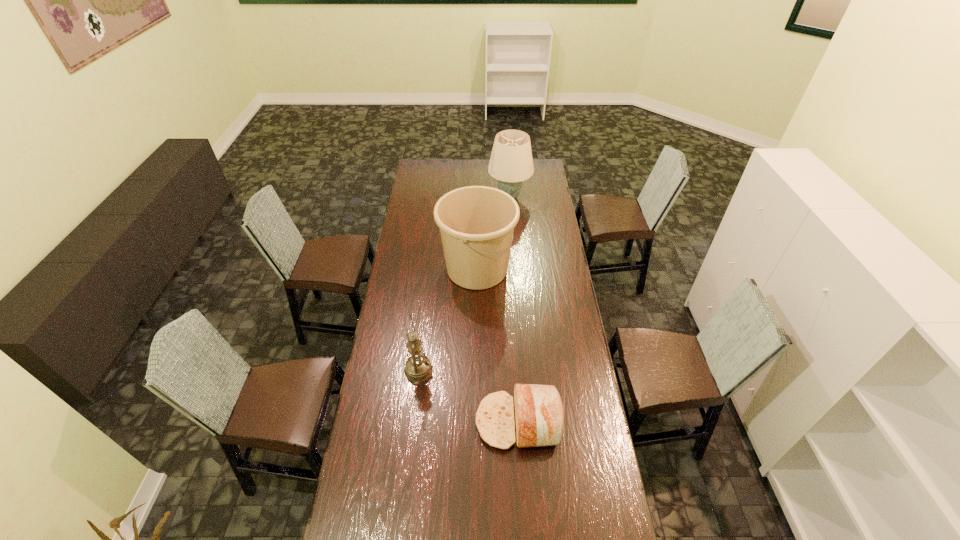
Where is `lampshade`? lampshade is located at coordinates (511, 162).

Identify the location of bucket. (476, 223).

The image size is (960, 540). Find the location of `oil lamp`. oil lamp is located at coordinates (418, 367).

Locate an element on the screen. The height and width of the screenshot is (540, 960). the nearest object is located at coordinates (539, 413).

You are a GUI agent. You are given a task and a screenshot of the screen. Output one action in this format:
    pyautogui.click(x=<x>, y=<y>)
    Task: Click on the bread
    The height and width of the screenshot is (540, 960).
    Given the screenshot: What is the action you would take?
    pyautogui.click(x=539, y=413)

You are a GUI agent. You are given a task and a screenshot of the screen. Output one action in this format:
    pyautogui.click(x=<x>, y=<y>)
    Task: Click on the vacant space positioned 0.070m on the back of the lampshade
    This screenshot has height=540, width=960.
    Given the screenshot: What is the action you would take?
    pyautogui.click(x=508, y=180)

The height and width of the screenshot is (540, 960). What are the coordinates of `vacant point located 0.370m on the front of the third nearest object` in the screenshot? It's located at (476, 365).

At what (x,y) coordinates should I click in order to perform the action: click on free region located 0.200m on the right of the third farthest object. Please return your answer as a coordinate pair (x, y). This screenshot has width=960, height=540. Looking at the image, I should click on (482, 370).

Where is `free space located at the sliced end of the nearest object`? This screenshot has width=960, height=540. free space located at the sliced end of the nearest object is located at coordinates (392, 421).

Locate an element on the screen. vacant space located 0.250m at the sliced end of the nearest object is located at coordinates (408, 421).